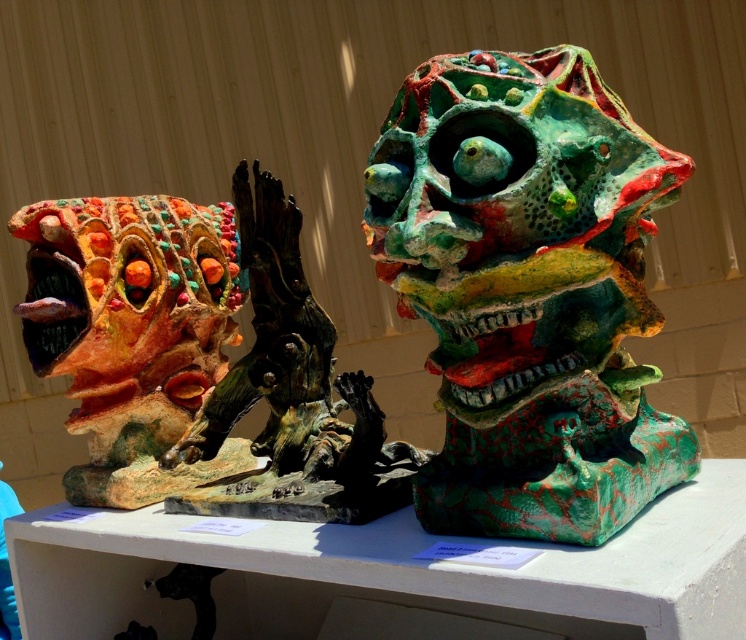
Is textured green sculpture at center taller than matte ceramic dragon at left?

Indeed, textured green sculpture at center has a greater height compared to matte ceramic dragon at left.

How distant is textured green sculpture at center from matte ceramic dragon at left?

The distance of textured green sculpture at center from matte ceramic dragon at left is 23.02 inches.

Is point (448, 429) in front of point (81, 468)?

Yes.

You are a GUI agent. You are given a task and a screenshot of the screen. Output one action in this format:
    pyautogui.click(x=<x>, y=<y>)
    Task: Click on the textured green sculpture at center
    
    Given the screenshot: What is the action you would take?
    coord(527,291)

Does matte ceramic dragon at left appear on the right side of textured clay sculpture at left?

Incorrect, matte ceramic dragon at left is not on the right side of textured clay sculpture at left.

Between point (65, 486) and point (316, 353), which one is positioned behind?

Point (65, 486)

Where is `matte ceramic dragon at left`? This screenshot has width=746, height=640. matte ceramic dragon at left is located at coordinates pyautogui.click(x=131, y=332).

Who is positioned more to the left, textured green sculpture at center or textured clay sculpture at left?

textured clay sculpture at left

Is textured green sculpture at center thinner than textured clay sculpture at left?

Incorrect, textured green sculpture at center's width is not less than textured clay sculpture at left's.

Who is more distant from viewer, (416,221) or (329,435)?

Point (329,435)

Where is `textured green sculpture at center`? The width and height of the screenshot is (746, 640). textured green sculpture at center is located at coordinates (527, 291).